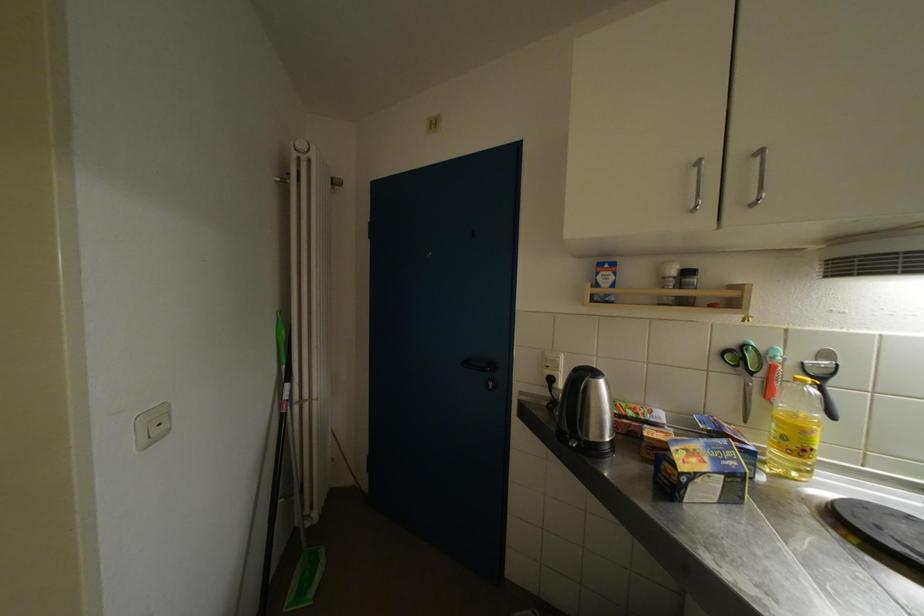
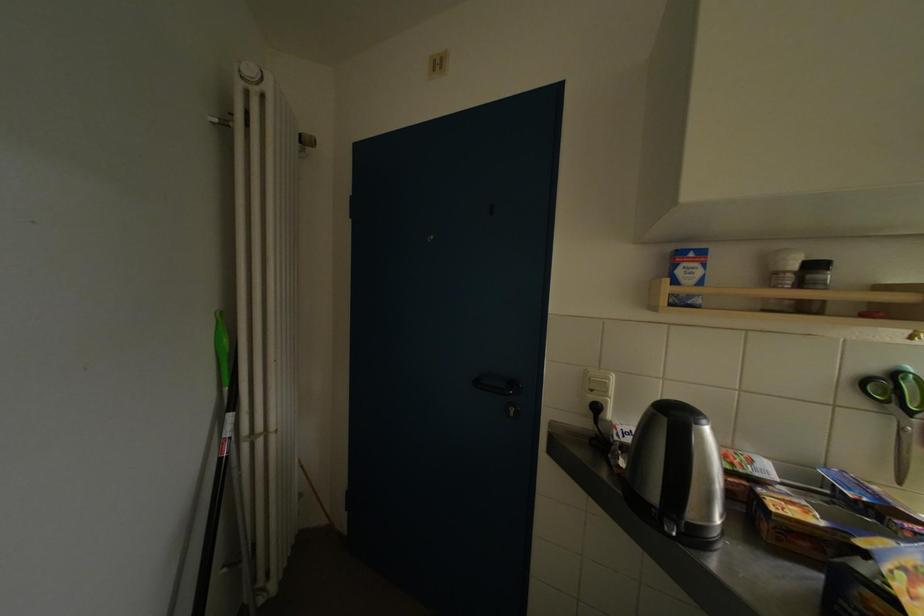
Question: In a continuous first-person perspective shot, in which direction is the camera moving?

Choices:
 (A) Left
 (B) Right
 (C) Forward
 (D) Backward

Answer: (C)